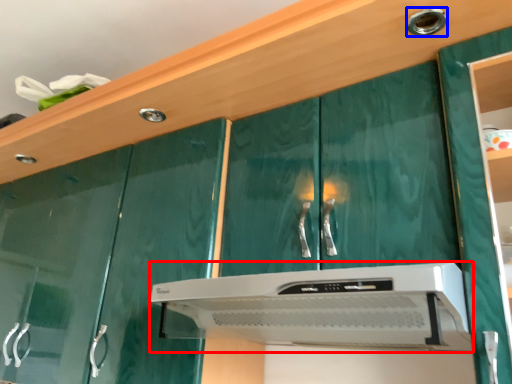
Question: Which object is closer to the camera taking this photo, home appliance (highlighted by a red box) or knob (highlighted by a blue box)?

Choices:
 (A) home appliance
 (B) knob

Answer: (A)